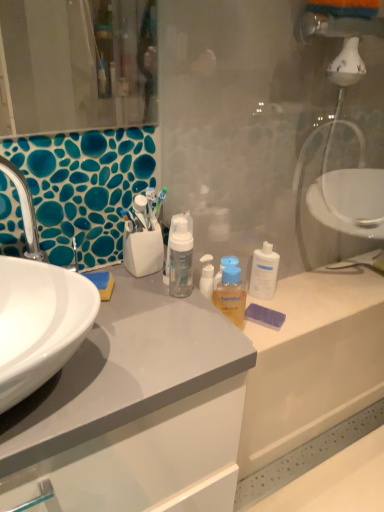
This screenshot has height=512, width=384. In order to click on free space in front of transparent plastic bottle at center in this screenshot , I will do `click(277, 324)`.